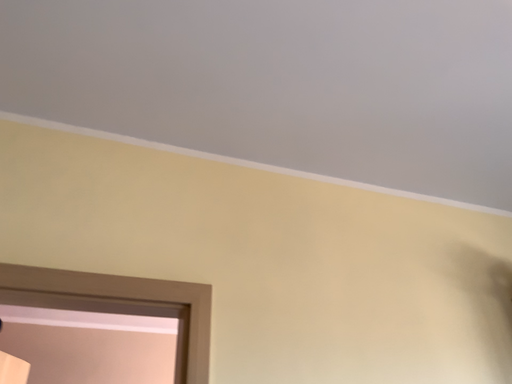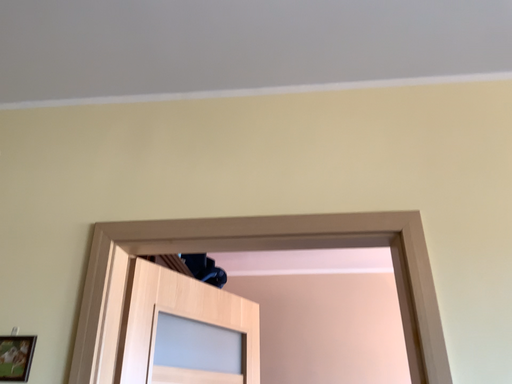
Question: Which way did the camera rotate in the video?

Choices:
 (A) rotated left
 (B) rotated right

Answer: (A)